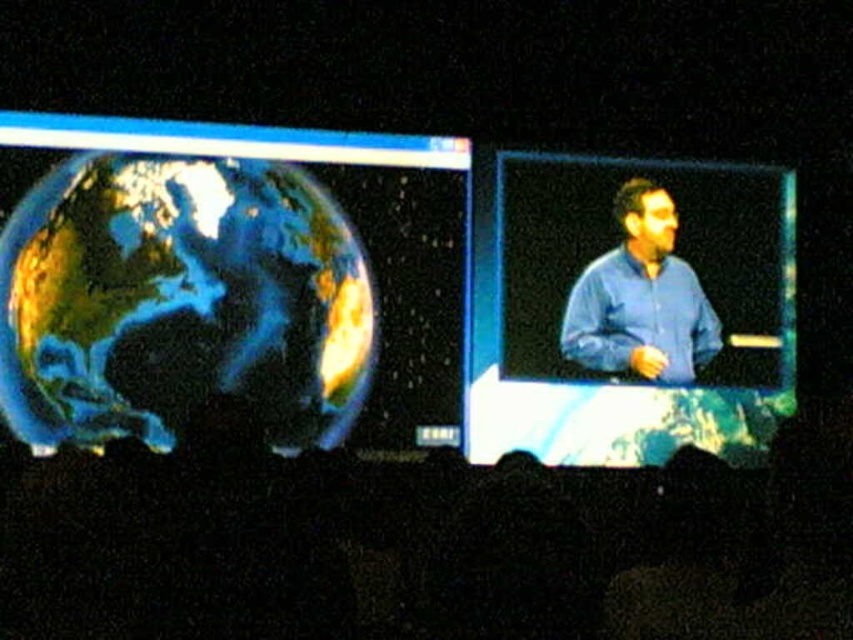
You are organizing a presentation and need to ensure that the blue fabric screen at right and the blue shirt at center are visible to all attendees. Given that the room has limited space, which object should be placed closer to the front to ensure visibility?

The blue fabric screen at right should be placed closer to the front because its width is larger than the blue shirt at center, making it more prominent and easier to see from a distance.